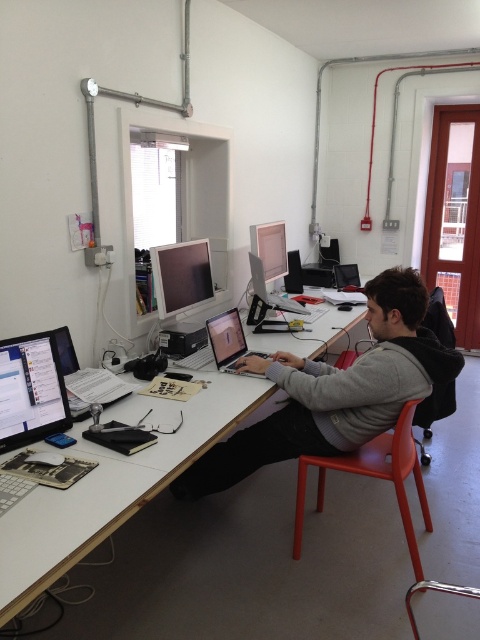
You are standing in the workspace and want to place a new device at point (31, 390). What object is currently located there?

The matte black monitor at left is located at point (31, 390).

You are an office worker who needs to place a new document on the white wood table at center. However, there is a gray sweater at center in the way. Can you place the document directly on the table without moving the sweater?

The white wood table at center is positioned under the gray sweater at center, so you can place the document directly on the table without moving the sweater as the sweater is above it.